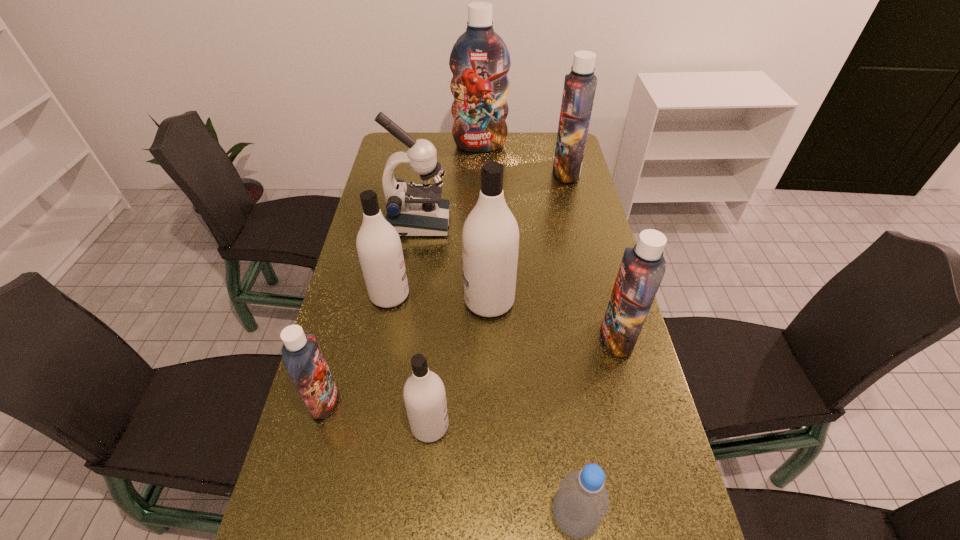
Choose which blue shampoo is the nearest neighbor to the second farthest object. Please provide its 2D coordinates. Your answer should be formatted as a tuple, i.e. [(x, y)], where the tuple contains the x and y coordinates of a point satisfying the conditions above.

[(479, 60)]

Select which blue shampoo appears as the third closest to the bottle. Please provide its 2D coordinates. Your answer should be formatted as a tuple, i.e. [(x, y)], where the tuple contains the x and y coordinates of a point satisfying the conditions above.

[(580, 84)]

The width and height of the screenshot is (960, 540). I want to click on the second closest white shampoo to the second white shampoo from right to left, so click(379, 248).

Locate an element on the screen. This screenshot has height=540, width=960. white shampoo that is the closest one to the shortest object is located at coordinates (424, 393).

Identify the location of free space in the image that satisfies the following two spatial constraints: 1. on the front label of the biggest blue shampoo; 2. on the front-facing side of the second biggest white shampoo. (480, 295).

Where is `vacant point that satisfies the following two spatial constraints: 1. on the front label of the biggest blue shampoo; 2. on the front-facing side of the second shampoo from left to right`? Image resolution: width=960 pixels, height=540 pixels. vacant point that satisfies the following two spatial constraints: 1. on the front label of the biggest blue shampoo; 2. on the front-facing side of the second shampoo from left to right is located at coordinates (480, 295).